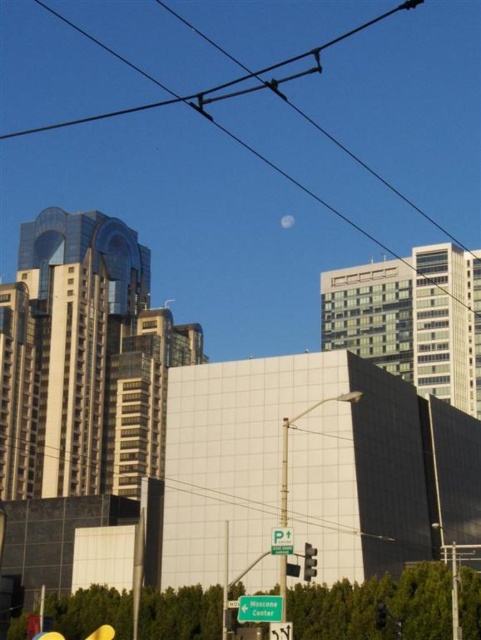
Measure the distance between transparent glass traffic light at center and metallic traffic light at center.

transparent glass traffic light at center is 10.20 meters from metallic traffic light at center.

Between transparent glass traffic light at center and metallic traffic light at center, which one appears on the left side from the viewer's perspective?

metallic traffic light at center is more to the left.

Which is behind, point (375, 616) or point (295, 576)?

The point (375, 616) is more distant.

Identify the location of transparent glass traffic light at center. This screenshot has width=481, height=640. (380, 614).

Where is `black wire at upper center`? Image resolution: width=481 pixels, height=640 pixels. black wire at upper center is located at coordinates (215, 208).

Is black wire at upper center closer to the viewer compared to metallic traffic light at center?

No, black wire at upper center is behind metallic traffic light at center.

Describe the element at coordinates (215, 208) in the screenshot. I see `black wire at upper center` at that location.

The height and width of the screenshot is (640, 481). In order to click on black wire at upper center in this screenshot , I will do `click(215, 208)`.

Which is above, red glass traffic light at center or transparent glass traffic light at center?

red glass traffic light at center

Find the location of a particular element. The width and height of the screenshot is (481, 640). red glass traffic light at center is located at coordinates (309, 561).

Between point (312, 563) and point (378, 609), which one is positioned behind?

Positioned behind is point (378, 609).

At what (x,y) coordinates should I click in order to perform the action: click on red glass traffic light at center. Please return your answer as a coordinate pair (x, y). The height and width of the screenshot is (640, 481). Looking at the image, I should click on (309, 561).